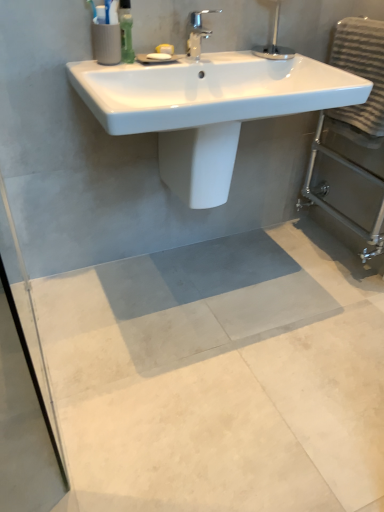
You are a GUI agent. You are given a task and a screenshot of the screen. Output one action in this format:
    pyautogui.click(x=<x>, y=<y>)
    Task: Click on the vacant space underneath white glossy sink at upper center (from a real-world perspective)
    
    Given the screenshot: What is the action you would take?
    pyautogui.click(x=209, y=274)